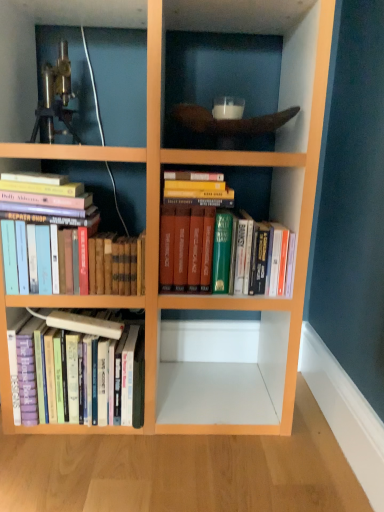
Identify the location of metallic tripod at upper left. This screenshot has height=512, width=384. (55, 98).

Measure the distance between hardcover books at left, which is counted as the second book, starting from the left, and camera.

A distance of 1.12 meters exists between hardcover books at left, which is counted as the second book, starting from the left, and camera.

What do you see at coordinates (79, 370) in the screenshot? I see `hardcover books at lower left, which appears as the first book when viewed from the left` at bounding box center [79, 370].

The image size is (384, 512). Identify the location of hardcover books at center, which is the 1th book in right-to-left order. (197, 189).

You are a GUI agent. You are given a task and a screenshot of the screen. Output one action in this format:
    pyautogui.click(x=<x>, y=<y>)
    Task: Click on the metallic tripod at upper left
    This screenshot has height=512, width=384.
    Given the screenshot: What is the action you would take?
    pyautogui.click(x=55, y=98)

Is metallic tripod at upper left not inside hardcover books at left, the 2th book positioned from the right?

metallic tripod at upper left is positioned outside hardcover books at left, the 2th book positioned from the right.

Is metallic tripod at upper left oriented towards hardcover books at left, the 2th book positioned from the right?

No, metallic tripod at upper left is not oriented towards hardcover books at left, the 2th book positioned from the right.

Considering the positions of objects metallic tripod at upper left and hardcover books at left, the 2th book positioned from the right, in the image provided, who is in front, metallic tripod at upper left or hardcover books at left, the 2th book positioned from the right,?

hardcover books at left, the 2th book positioned from the right, is in front.

Is metallic tripod at upper left in contact with hardcover books at left, which is counted as the second book, starting from the left?

There is a gap between metallic tripod at upper left and hardcover books at left, which is counted as the second book, starting from the left.

From the image's perspective, is hardcover books at lower left, which appears as the first book when viewed from the left, over hardcover books at left, the 2th book positioned from the right?

Actually, hardcover books at lower left, which appears as the first book when viewed from the left, appears below hardcover books at left, the 2th book positioned from the right, in the image.

Is point (135, 331) closer to viewer compared to point (49, 185)?

No.

Considering the relative positions of hardcover books at lower left, which appears as the first book when viewed from the left, and hardcover books at left, which is counted as the second book, starting from the left, in the image provided, is hardcover books at lower left, which appears as the first book when viewed from the left, to the left of hardcover books at left, which is counted as the second book, starting from the left, from the viewer's perspective?

Correct, you'll find hardcover books at lower left, which appears as the first book when viewed from the left, to the left of hardcover books at left, which is counted as the second book, starting from the left.

Is hardcover books at lower left, which appears as the first book when viewed from the left, bigger or smaller than hardcover books at left, the 2th book positioned from the right?

Considering their sizes, hardcover books at lower left, which appears as the first book when viewed from the left, takes up more space than hardcover books at left, the 2th book positioned from the right.

Considering the positions of point (53, 409) and point (212, 198), is point (53, 409) closer or farther from the camera than point (212, 198)?

Point (53, 409) appears to be farther away from the viewer than point (212, 198).

Is hardcover books at lower left, which appears as the first book when viewed from the left, in front of or behind hardcover books at center, which is the 1th book in right-to-left order, in the image?

In the image, hardcover books at lower left, which appears as the first book when viewed from the left, appears behind hardcover books at center, which is the 1th book in right-to-left order.

Is hardcover books at lower left, which appears as the first book when viewed from the left, turned away from hardcover books at center, which is the 1th book in right-to-left order?

No.

Are hardcover books at lower left, which appears as the first book when viewed from the left, and hardcover books at center, which is the 1th book in right-to-left order, beside each other?

hardcover books at lower left, which appears as the first book when viewed from the left, and hardcover books at center, which is the 1th book in right-to-left order, are not in contact.

Locate an element on the screen. book on the left of hardcover books at left, the 2th book positioned from the right is located at coordinates (79, 370).

In the scene shown: Is hardcover books at left, which is counted as the second book, starting from the left, facing towards hardcover books at lower left, which appears as the first book when viewed from the left?

No, hardcover books at left, which is counted as the second book, starting from the left, is not oriented towards hardcover books at lower left, which appears as the first book when viewed from the left.

Considering the relative sizes of hardcover books at left, which is counted as the second book, starting from the left, and hardcover books at lower left, which appears as the first book when viewed from the left, in the image provided, is hardcover books at left, which is counted as the second book, starting from the left, shorter than hardcover books at lower left, which appears as the first book when viewed from the left,?

Indeed, hardcover books at left, which is counted as the second book, starting from the left, has a lesser height compared to hardcover books at lower left, which appears as the first book when viewed from the left.

Looking at this image, considering the positions of objects hardcover books at center, which is the 1th book in right-to-left order, and hardcover books at lower left, which appears as the first book when viewed from the left, in the image provided, who is more to the right, hardcover books at center, which is the 1th book in right-to-left order, or hardcover books at lower left, which appears as the first book when viewed from the left,?

Positioned to the right is hardcover books at center, which is the 1th book in right-to-left order.

Which object is closer to the camera, hardcover books at center, which is the 1th book in right-to-left order, or hardcover books at lower left, which appears as the first book when viewed from the left?

Positioned in front is hardcover books at center, which is the 1th book in right-to-left order.

Does hardcover books at center, which is the 1th book in right-to-left order, have a greater width compared to hardcover books at lower left, which ranks as the third book in right-to-left order?

Yes.

From a real-world perspective, is hardcover books at center, which is the 1th book in right-to-left order, physically located above or below hardcover books at lower left, which appears as the first book when viewed from the left?

hardcover books at center, which is the 1th book in right-to-left order, is situated higher than hardcover books at lower left, which appears as the first book when viewed from the left, in the real world.

Find the location of `telescope above the hardcover books at lower left, which ranks as the third book in right-to-left order (from a real-world perspective)`. telescope above the hardcover books at lower left, which ranks as the third book in right-to-left order (from a real-world perspective) is located at coordinates (55, 98).

Is metallic tripod at upper left oriented towards hardcover books at lower left, which appears as the first book when viewed from the left?

No.

Is metallic tripod at upper left inside the boundaries of hardcover books at lower left, which appears as the first book when viewed from the left, or outside?

The correct answer is: outside.

Is metallic tripod at upper left bigger or smaller than hardcover books at center, which is the 1th book in right-to-left order?

Clearly, metallic tripod at upper left is smaller in size than hardcover books at center, which is the 1th book in right-to-left order.

Are metallic tripod at upper left and hardcover books at center, which is the 3th book from left to right, making contact?

No, metallic tripod at upper left is not next to hardcover books at center, which is the 3th book from left to right.

Considering the positions of objects metallic tripod at upper left and hardcover books at center, which is the 1th book in right-to-left order, in the image provided, who is more to the right, metallic tripod at upper left or hardcover books at center, which is the 1th book in right-to-left order,?

hardcover books at center, which is the 1th book in right-to-left order.

Identify the location of telescope on the left of hardcover books at left, which is counted as the second book, starting from the left. pos(55,98).

The width and height of the screenshot is (384, 512). Identify the location of book directly beneath the hardcover books at left, which is counted as the second book, starting from the left (from a real-world perspective). (79, 370).

Estimate the real-world distances between objects in this image. Which object is further from hardcover books at center, which is the 1th book in right-to-left order, hardcover books at left, which is counted as the second book, starting from the left, or hardcover books at lower left, which ranks as the third book in right-to-left order?

hardcover books at lower left, which ranks as the third book in right-to-left order, lies further to hardcover books at center, which is the 1th book in right-to-left order, than the other object.

Looking at the image, which one is located further to hardcover books at lower left, which ranks as the third book in right-to-left order, metallic tripod at upper left or hardcover books at left, which is counted as the second book, starting from the left?

The object further to hardcover books at lower left, which ranks as the third book in right-to-left order, is metallic tripod at upper left.

From the image, which object appears to be farther from hardcover books at center, which is the 3th book from left to right, metallic tripod at upper left or hardcover books at left, the 2th book positioned from the right?

Based on the image, metallic tripod at upper left appears to be further to hardcover books at center, which is the 3th book from left to right.

From the image, which object appears to be nearer to metallic tripod at upper left, hardcover books at lower left, which appears as the first book when viewed from the left, or hardcover books at left, the 2th book positioned from the right?

Based on the image, hardcover books at left, the 2th book positioned from the right, appears to be nearer to metallic tripod at upper left.

Looking at the image, which one is located closer to metallic tripod at upper left, hardcover books at center, which is the 1th book in right-to-left order, or hardcover books at left, the 2th book positioned from the right?

hardcover books at left, the 2th book positioned from the right.

Estimate the real-world distances between objects in this image. Which object is closer to hardcover books at lower left, which ranks as the third book in right-to-left order, hardcover books at left, the 2th book positioned from the right, or metallic tripod at upper left?

Among the two, hardcover books at left, the 2th book positioned from the right, is located nearer to hardcover books at lower left, which ranks as the third book in right-to-left order.

Which object lies further to the anchor point hardcover books at left, which is counted as the second book, starting from the left, hardcover books at center, which is the 1th book in right-to-left order, or metallic tripod at upper left?

metallic tripod at upper left is positioned further to the anchor hardcover books at left, which is counted as the second book, starting from the left.

When comparing their distances from hardcover books at left, which is counted as the second book, starting from the left, does metallic tripod at upper left or hardcover books at center, which is the 3th book from left to right, seem further?

Among the two, metallic tripod at upper left is located further to hardcover books at left, which is counted as the second book, starting from the left.

Locate an element on the screen. book between hardcover books at lower left, which ranks as the third book in right-to-left order, and hardcover books at center, which is the 3th book from left to right is located at coordinates (65, 240).